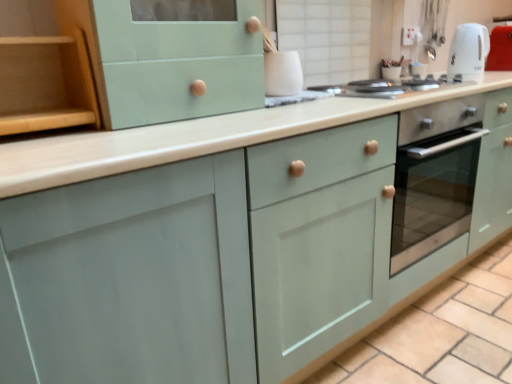
The image size is (512, 384). Find the location of `free space on the front side of white glossy electric kettle at upper right`. free space on the front side of white glossy electric kettle at upper right is located at coordinates (476, 80).